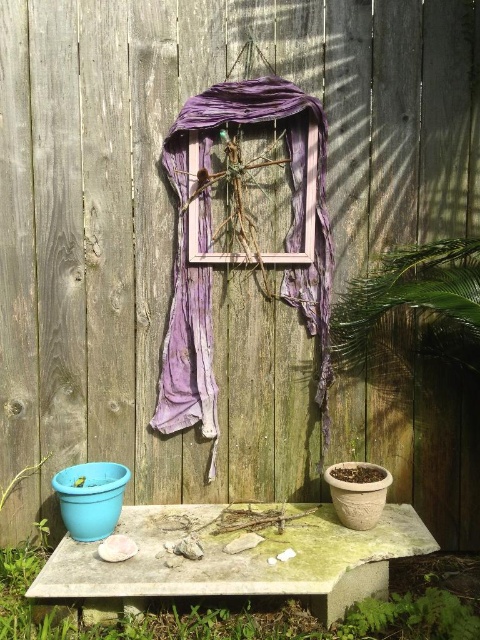
Can you confirm if green mossy concrete at center is taller than purple fabric at center?

Incorrect, green mossy concrete at center's height is not larger of purple fabric at center's.

Which is above, green mossy concrete at center or purple fabric at center?

Positioned higher is purple fabric at center.

Between point (375, 566) and point (178, 326), which one is positioned behind?

The point (178, 326) is more distant.

At what (x,y) coordinates should I click in order to perform the action: click on green mossy concrete at center. Please return your answer as a coordinate pair (x, y). Looking at the image, I should click on (236, 557).

Between purple fabric at center and wooden frame at center, which one appears on the left side from the viewer's perspective?

purple fabric at center

Is point (179, 278) farther from viewer compared to point (193, 164)?

Yes.

Is point (200, 280) positioned in front of point (190, 211)?

No, (200, 280) is behind (190, 211).

The width and height of the screenshot is (480, 640). I want to click on purple fabric at center, so click(240, 243).

In the scene shown: Is green mossy concrete at center taller than wooden frame at center?

In fact, green mossy concrete at center may be shorter than wooden frame at center.

Can you confirm if green mossy concrete at center is thinner than wooden frame at center?

Incorrect, green mossy concrete at center's width is not less than wooden frame at center's.

The image size is (480, 640). I want to click on green mossy concrete at center, so click(236, 557).